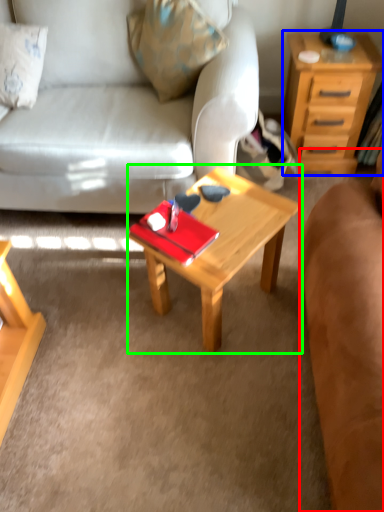
Question: Which object is positioned farthest from studio couch (highlighted by a red box)? Select from nightstand (highlighted by a blue box) and coffee table (highlighted by a green box).

Choices:
 (A) nightstand
 (B) coffee table

Answer: (A)